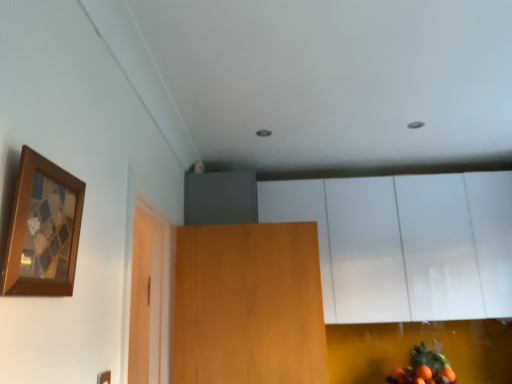
In order to face wooden door at center, should I rotate leftwards or rightwards?

Turn left approximately 0.840 degrees to face it.

This screenshot has width=512, height=384. What do you see at coordinates (424, 367) in the screenshot?
I see `orange matte fruit at lower right` at bounding box center [424, 367].

At what (x,y) coordinates should I click in order to perform the action: click on wooden picture frame at upper left. Please return your answer as a coordinate pair (x, y). The image size is (512, 384). Looking at the image, I should click on (42, 230).

Choose the correct answer: Is wooden door at center inside white glossy cabinet at upper center or outside it?

wooden door at center is located beyond the bounds of white glossy cabinet at upper center.

Measure the distance from wooden door at center to white glossy cabinet at upper center.

wooden door at center is 71.44 centimeters from white glossy cabinet at upper center.

Which of these two, wooden door at center or white glossy cabinet at upper center, is wider?

With larger width is white glossy cabinet at upper center.

From a real-world perspective, is wooden door at center positioned above or below white glossy cabinet at upper center?

wooden door at center is situated lower than white glossy cabinet at upper center in the real world.

Does white glossy cabinet at upper center have a greater height compared to wooden door at center?

Indeed, white glossy cabinet at upper center has a greater height compared to wooden door at center.

Does white glossy cabinet at upper center contain wooden door at center?

That's incorrect, wooden door at center is not inside white glossy cabinet at upper center.

Between white glossy cabinet at upper center and wooden door at center, which one appears on the left side from the viewer's perspective?

From the viewer's perspective, wooden door at center appears more on the left side.

Consider the image. What's the angular difference between wooden picture frame at upper left and white glossy cabinet at upper center's facing directions?

The facing directions of wooden picture frame at upper left and white glossy cabinet at upper center are 89.6 degrees apart.

Considering the sizes of objects wooden picture frame at upper left and white glossy cabinet at upper center in the image provided, who is shorter, wooden picture frame at upper left or white glossy cabinet at upper center?

Standing shorter between the two is wooden picture frame at upper left.

Does wooden picture frame at upper left turn towards white glossy cabinet at upper center?

No, wooden picture frame at upper left is not aimed at white glossy cabinet at upper center.

This screenshot has height=384, width=512. What are the coordinates of `door on the left of orange matte fruit at lower right` in the screenshot? It's located at (248, 305).

From a real-world perspective, is orange matte fruit at lower right physically located above or below wooden door at center?

orange matte fruit at lower right is situated lower than wooden door at center in the real world.

Considering the sizes of objects orange matte fruit at lower right and wooden door at center in the image provided, who is shorter, orange matte fruit at lower right or wooden door at center?

orange matte fruit at lower right is shorter.

Does orange matte fruit at lower right contain wooden door at center?

No, orange matte fruit at lower right does not contain wooden door at center.

What are the coordinates of `picture frame lying above the wooden door at center (from the image's perspective)` in the screenshot? It's located at (42, 230).

Based on the photo, from a real-world perspective, is wooden picture frame at upper left located beneath wooden door at center?

No, from a real-world perspective, wooden picture frame at upper left is not under wooden door at center.

Which is less distant, (62, 289) or (313, 355)?

Point (62, 289) is positioned closer to the camera compared to point (313, 355).

Is wooden picture frame at upper left positioned with its back to wooden door at center?

wooden picture frame at upper left is not turned away from wooden door at center.

Can you confirm if orange matte fruit at lower right is positioned to the left of white glossy cabinet at upper center?

No, orange matte fruit at lower right is not to the left of white glossy cabinet at upper center.

What's the angular difference between orange matte fruit at lower right and white glossy cabinet at upper center's facing directions?

There is a 0.009-degree angle between the facing directions of orange matte fruit at lower right and white glossy cabinet at upper center.

Considering the sizes of objects orange matte fruit at lower right and white glossy cabinet at upper center in the image provided, who is taller, orange matte fruit at lower right or white glossy cabinet at upper center?

white glossy cabinet at upper center is taller.

Is white glossy cabinet at upper center thinner than orange matte fruit at lower right?

In fact, white glossy cabinet at upper center might be wider than orange matte fruit at lower right.

Between white glossy cabinet at upper center and orange matte fruit at lower right, which one appears on the left side from the viewer's perspective?

Positioned to the left is white glossy cabinet at upper center.

Which point is more forward, (352, 267) or (454, 379)?

Positioned in front is point (454, 379).

From a real-world perspective, which object stands above the other?

From a 3D spatial view, white glossy cabinet at upper center is above.

Find the location of a particular element. This screenshot has width=512, height=384. cabinetry lying above the wooden door at center (from the image's perspective) is located at coordinates (406, 244).

Image resolution: width=512 pixels, height=384 pixels. What are the coordinates of `door on the left of white glossy cabinet at upper center` in the screenshot? It's located at (248, 305).

Which object lies nearer to the anchor point white glossy cabinet at upper center, wooden picture frame at upper left or orange matte fruit at lower right?

orange matte fruit at lower right is closer to white glossy cabinet at upper center.

When comparing their distances from wooden picture frame at upper left, does orange matte fruit at lower right or white glossy cabinet at upper center seem further?

orange matte fruit at lower right.

Considering their positions, is wooden door at center positioned further to wooden picture frame at upper left than white glossy cabinet at upper center?

Based on the image, white glossy cabinet at upper center appears to be further to wooden picture frame at upper left.

When comparing their distances from orange matte fruit at lower right, does wooden door at center or white glossy cabinet at upper center seem further?

Based on the image, wooden door at center appears to be further to orange matte fruit at lower right.

Which object lies further to the anchor point white glossy cabinet at upper center, wooden picture frame at upper left or wooden door at center?

The object further to white glossy cabinet at upper center is wooden picture frame at upper left.

Which object lies nearer to the anchor point orange matte fruit at lower right, wooden picture frame at upper left or white glossy cabinet at upper center?

white glossy cabinet at upper center is closer to orange matte fruit at lower right.

Considering their positions, is wooden door at center positioned further to white glossy cabinet at upper center than orange matte fruit at lower right?

wooden door at center is positioned further to the anchor white glossy cabinet at upper center.

From the image, which object appears to be farther from wooden picture frame at upper left, wooden door at center or orange matte fruit at lower right?

The object further to wooden picture frame at upper left is orange matte fruit at lower right.

At what (x,y) coordinates should I click in order to perform the action: click on cabinetry between wooden door at center and orange matte fruit at lower right from left to right. Please return your answer as a coordinate pair (x, y). Looking at the image, I should click on (406, 244).

This screenshot has height=384, width=512. I want to click on fruit located between wooden picture frame at upper left and white glossy cabinet at upper center in the depth direction, so click(x=424, y=367).

At what (x,y) coordinates should I click in order to perform the action: click on door between wooden picture frame at upper left and orange matte fruit at lower right in the front-back direction. Please return your answer as a coordinate pair (x, y). Looking at the image, I should click on (248, 305).

I want to click on door between wooden picture frame at upper left and white glossy cabinet at upper center in the front-back direction, so click(x=248, y=305).